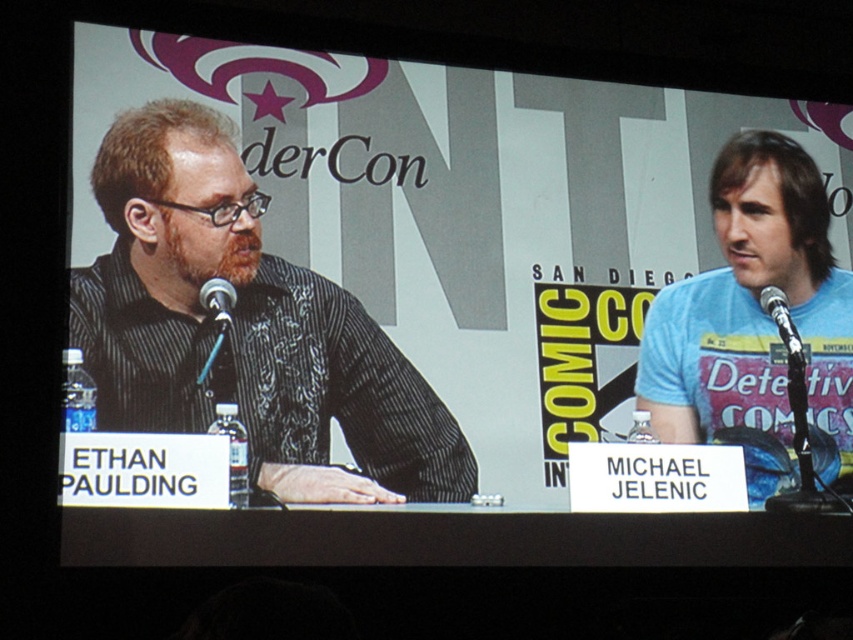
Question: Does metallic silver microphone at right have a larger size compared to black plastic microphone at left?

Choices:
 (A) no
 (B) yes

Answer: (B)

Question: Can you confirm if metallic silver microphone at right is smaller than black plastic microphone at left?

Choices:
 (A) no
 (B) yes

Answer: (A)

Question: Which of the following is the farthest from the observer?

Choices:
 (A) (216, 321)
 (B) (784, 312)
 (C) (788, 432)
 (D) (82, 269)

Answer: (B)

Question: Is black textured shirt at left thinner than light blue t-shirt at right?

Choices:
 (A) no
 (B) yes

Answer: (A)

Question: Which of the following is the farthest from the observer?

Choices:
 (A) (233, 298)
 (B) (103, 422)

Answer: (A)

Question: Which of the following is the closest to the observer?

Choices:
 (A) metallic silver microphone at right
 (B) matte black shirt at left
 (C) light blue t-shirt at right
 (D) black textured shirt at left

Answer: (D)